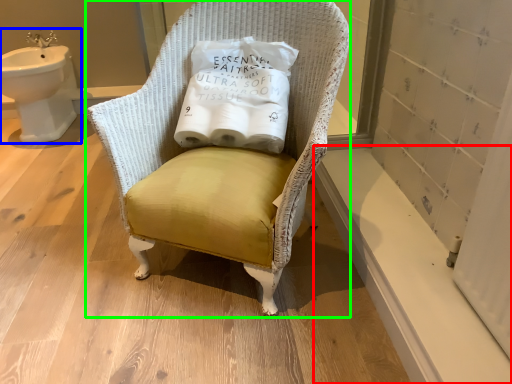
Question: Which object is the farthest from window sill (highlighted by a red box)? Choose among these: sink (highlighted by a blue box) or chair (highlighted by a green box).

Choices:
 (A) sink
 (B) chair

Answer: (A)